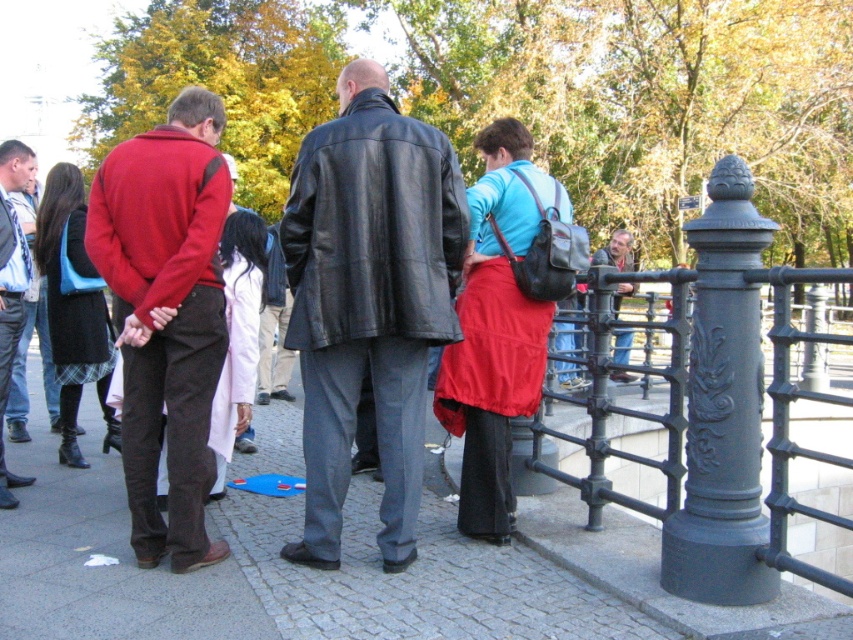
Question: Among these points, which one is nearest to the camera?

Choices:
 (A) (190, 264)
 (B) (614, 259)

Answer: (A)

Question: Where is black leather jacket at center located in relation to matte red jacket at left in the image?

Choices:
 (A) below
 (B) above

Answer: (B)

Question: Does matte red jacket at left have a greater width compared to matte black jacket at left?

Choices:
 (A) no
 (B) yes

Answer: (B)

Question: Can you confirm if matte red sweater at left is smaller than matte red jacket at left?

Choices:
 (A) yes
 (B) no

Answer: (B)

Question: Among these objects, which one is farthest from the camera?

Choices:
 (A) matte black jacket at left
 (B) matte red sweater at left

Answer: (A)

Question: Which point is farther to the camera?

Choices:
 (A) matte red jacket at left
 (B) black leather jacket at center
 (C) blue jeans at right
 (D) matte red sweater at left

Answer: (C)